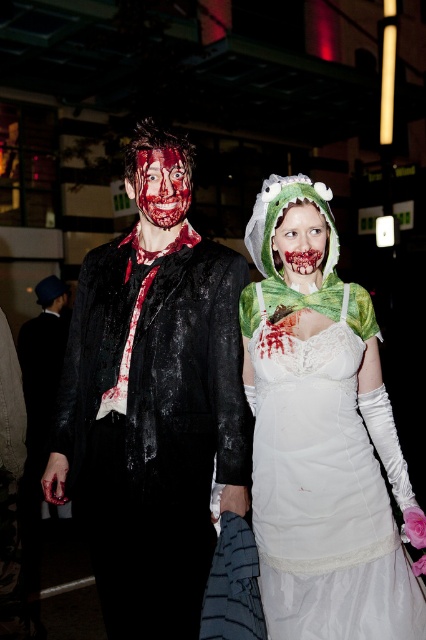
Is bloodied flesh face at center behind blood-stained fabric face at center?

That is True.

Can you confirm if bloodied flesh face at center is positioned below blood-stained fabric face at center?

No, bloodied flesh face at center is not below blood-stained fabric face at center.

Does point (175, 220) come farther from viewer compared to point (307, 221)?

Yes, point (175, 220) is behind point (307, 221).

Where is `bloodied flesh face at center`? The height and width of the screenshot is (640, 426). bloodied flesh face at center is located at coordinates (161, 186).

Can you confirm if white lace dress at center is shorter than blood-stained fabric face at center?

In fact, white lace dress at center may be taller than blood-stained fabric face at center.

Does point (359, 472) come closer to viewer compared to point (310, 256)?

Yes, point (359, 472) is closer to viewer.

Who is more distant from viewer, (420, 600) or (301, 268)?

The point (301, 268) is more distant.

I want to click on white lace dress at center, so [x=322, y=445].

Does white lace dress at center have a greater height compared to bloodied flesh face at center?

Yes.

Does point (287, 342) come in front of point (127, 180)?

Yes, point (287, 342) is in front of point (127, 180).

Find the location of a particular element. white lace dress at center is located at coordinates (322, 445).